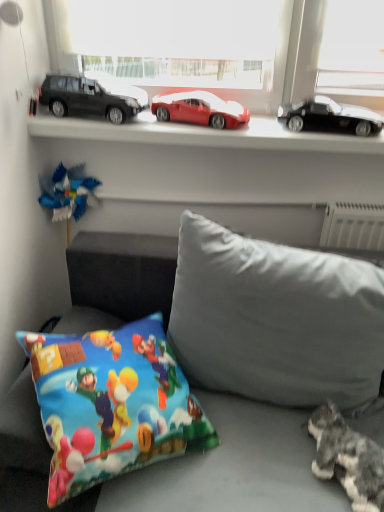
Image resolution: width=384 pixels, height=512 pixels. Identify the location of free spot below glossy black car at upper right, which is counted as the third car, starting from the left (from a real-world perspective). (325, 133).